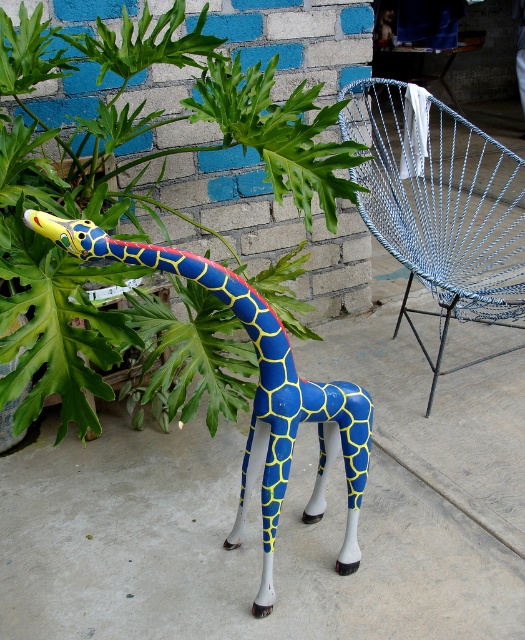
Question: Can you confirm if green leafy plant at center is positioned above blue glossy giraffe at center?

Choices:
 (A) yes
 (B) no

Answer: (A)

Question: Can you confirm if green leafy plant at center is smaller than blue woven wire chair at right?

Choices:
 (A) no
 (B) yes

Answer: (B)

Question: Which point appears closest to the camera in this image?

Choices:
 (A) (353, 440)
 (B) (42, 172)
 (C) (407, 145)

Answer: (A)

Question: Does green leafy plant at center appear on the right side of blue woven wire chair at right?

Choices:
 (A) no
 (B) yes

Answer: (A)

Question: Which object appears closest to the camera in this image?

Choices:
 (A) blue glossy giraffe at center
 (B) green leafy plant at center
 (C) blue woven wire chair at right

Answer: (A)

Question: Among these points, which one is farthest from the camera?

Choices:
 (A) (242, 472)
 (B) (17, 205)
 (C) (505, 230)

Answer: (C)